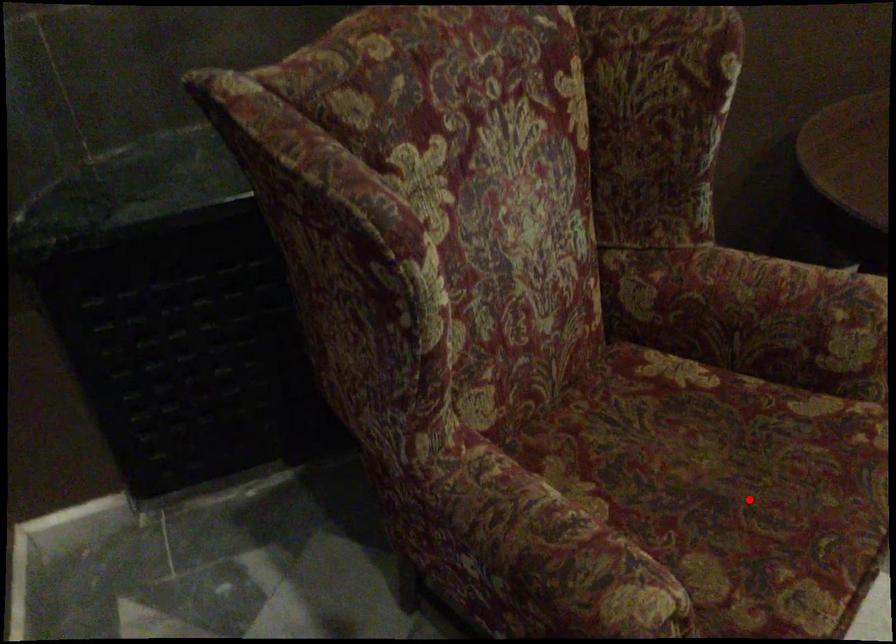
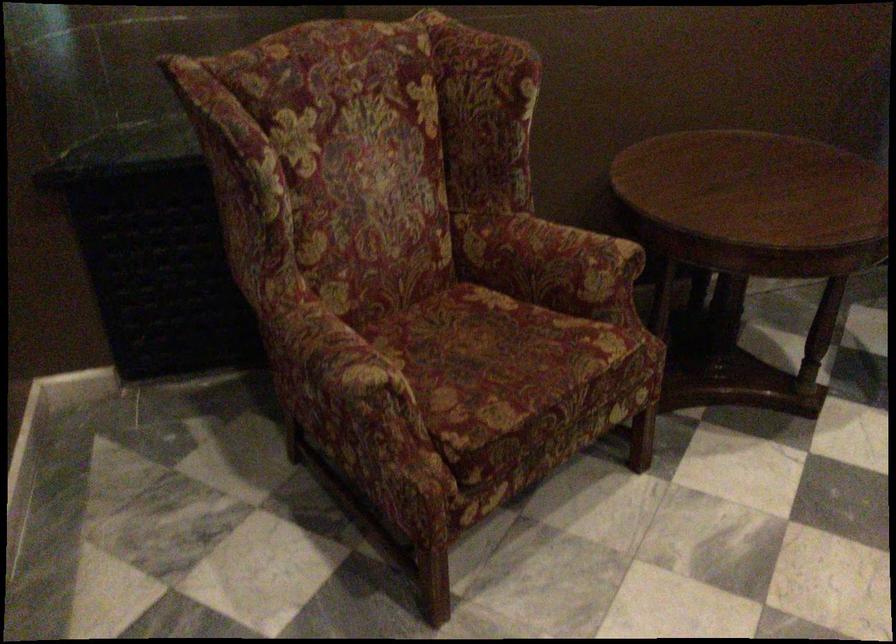
In the second image, find the point that corresponds to the highlighted location in the first image.

(495, 363)